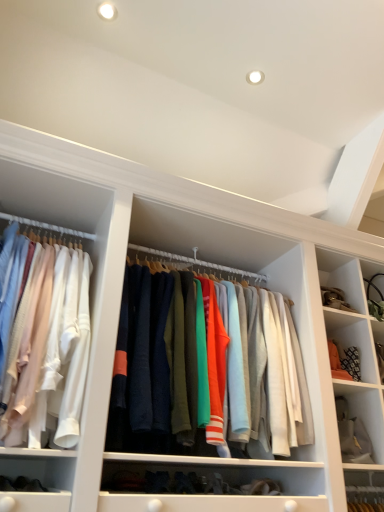
Question: From a real-world perspective, is knit sweater at center, which is the 1th clothing from right to left, above or below matte white shirts at left, acting as the first clothing starting from the left?

Choices:
 (A) above
 (B) below

Answer: (B)

Question: In the image, is knit sweater at center, placed as the second clothing when sorted from left to right, positioned in front of or behind matte white shirts at left, which is counted as the second clothing, starting from the right?

Choices:
 (A) behind
 (B) front

Answer: (A)

Question: Which object is the farthest from the white fabric at lower right?

Choices:
 (A) knit sweater at center, placed as the second clothing when sorted from left to right
 (B) matte white shirts at left, which is counted as the second clothing, starting from the right

Answer: (B)

Question: Which is nearer to the matte white shirts at left, acting as the first clothing starting from the left?

Choices:
 (A) white fabric at lower right
 (B) knit sweater at center, which is the 1th clothing from right to left

Answer: (B)